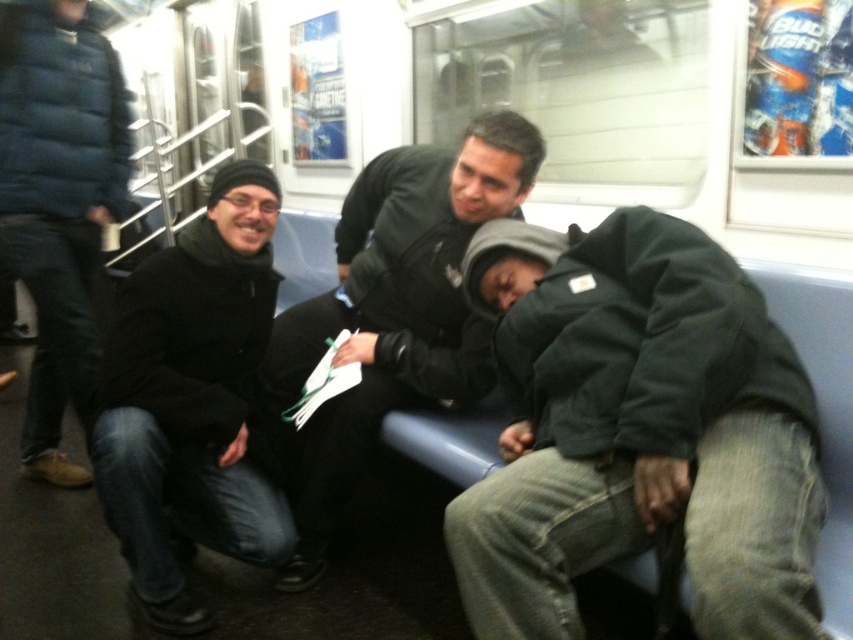
Which is more to the left, dark green jacket at lower right or black matte jacket at lower left?

black matte jacket at lower left is more to the left.

Is dark green jacket at lower right to the left of black matte jacket at lower left from the viewer's perspective?

In fact, dark green jacket at lower right is to the right of black matte jacket at lower left.

Which is in front, point (561, 360) or point (276, 195)?

Point (561, 360) is more forward.

This screenshot has width=853, height=640. Identify the location of dark green jacket at lower right. (637, 432).

Does dark green jacket at lower right appear under dark green jacket at center?

Yes, dark green jacket at lower right is below dark green jacket at center.

Who is more distant from viewer, (563, 636) or (312, 509)?

Positioned behind is point (312, 509).

Where is `dark green jacket at lower right`? dark green jacket at lower right is located at coordinates (637, 432).

Between black matte jacket at lower left and dark green jacket at center, which one is positioned lower?

black matte jacket at lower left is lower down.

How much distance is there between black matte jacket at lower left and dark green jacket at center?

11.41 inches

Who is more distant from viewer, (236,340) or (399,364)?

The point (399,364) is more distant.

Where is `black matte jacket at lower left`? Image resolution: width=853 pixels, height=640 pixels. black matte jacket at lower left is located at coordinates (190, 401).